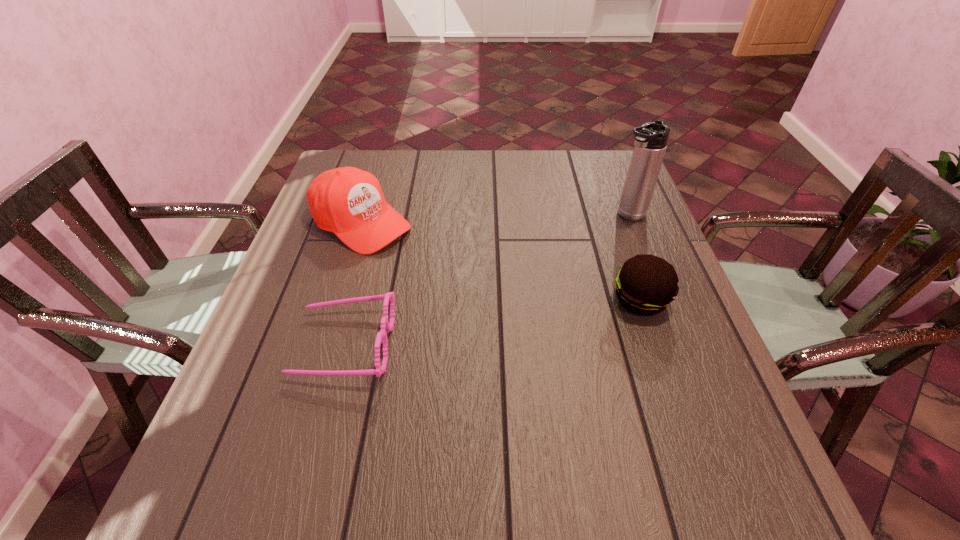
Locate an element on the screen. free point between the tallest object and the shortest object is located at coordinates (486, 280).

Find the location of a particular element. unoccupied position between the third tallest object and the shortest object is located at coordinates (492, 322).

I want to click on free spot between the tallest object and the third shortest object, so click(494, 220).

Locate which object ranks second in proximity to the tallest object. Please provide its 2D coordinates. Your answer should be formatted as a tuple, i.e. [(x, y)], where the tuple contains the x and y coordinates of a point satisfying the conditions above.

[(349, 202)]

Locate an element on the screen. Image resolution: width=960 pixels, height=540 pixels. the closest object to the second tallest object is located at coordinates coord(381,337).

The image size is (960, 540). Find the location of `free point that satisfies the following two spatial constraints: 1. on the front side of the second tallest object; 2. on the right side of the patty`. free point that satisfies the following two spatial constraints: 1. on the front side of the second tallest object; 2. on the right side of the patty is located at coordinates (337, 300).

Where is `free space that satisfies the following two spatial constraints: 1. on the back side of the second shortest object; 2. on the right side of the thermos bottle`? This screenshot has height=540, width=960. free space that satisfies the following two spatial constraints: 1. on the back side of the second shortest object; 2. on the right side of the thermos bottle is located at coordinates (611, 216).